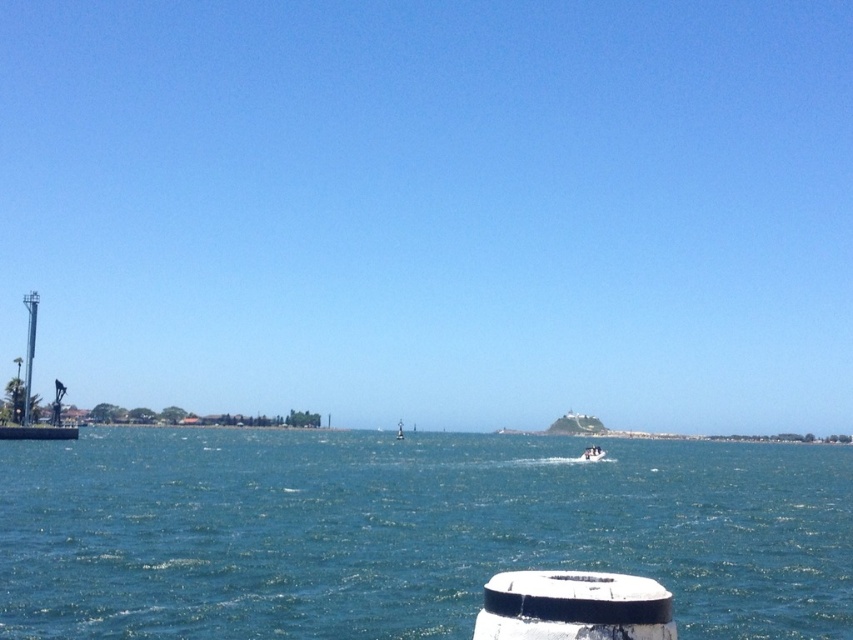
You are standing at the point marked by the white cylindrical object in the bottom right corner of the image. Looking out towards the water, you see a point labeled as point (x=592, y=452). What object is located at that point?

The point (x=592, y=452) corresponds to the white matte boat at center.

You are a photographer planning to capture the entire scene of the blue water at center and the white glossy boat at center in one shot. Based on the scene, which object will occupy more of the horizontal space in the photo?

The blue water at center will occupy more horizontal space in the photo since its width surpasses that of the white glossy boat at center.

You are standing on the dock and see the blue water at center and the white glossy boat at center. Which object is positioned to the right of the other?

The blue water at center is to the right of the white glossy boat at center.